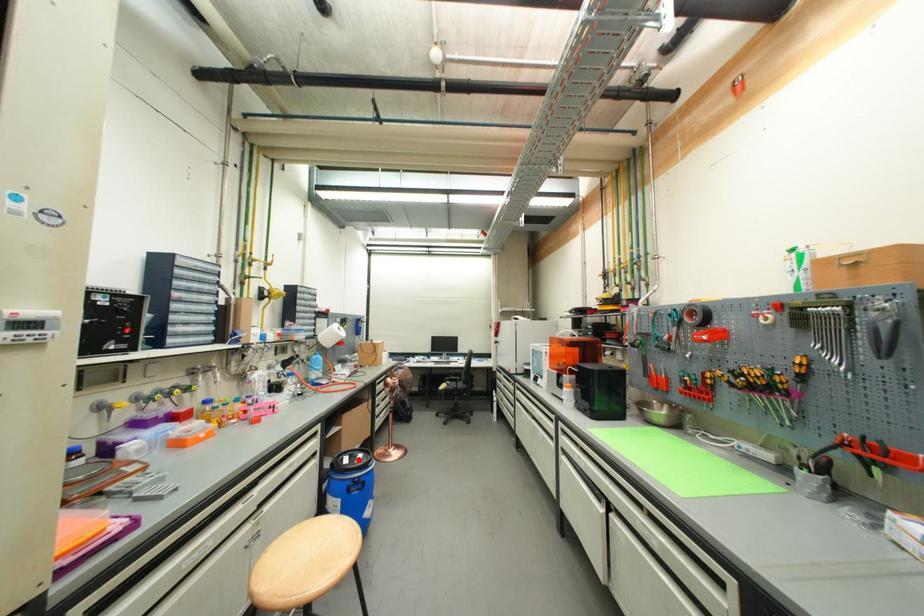
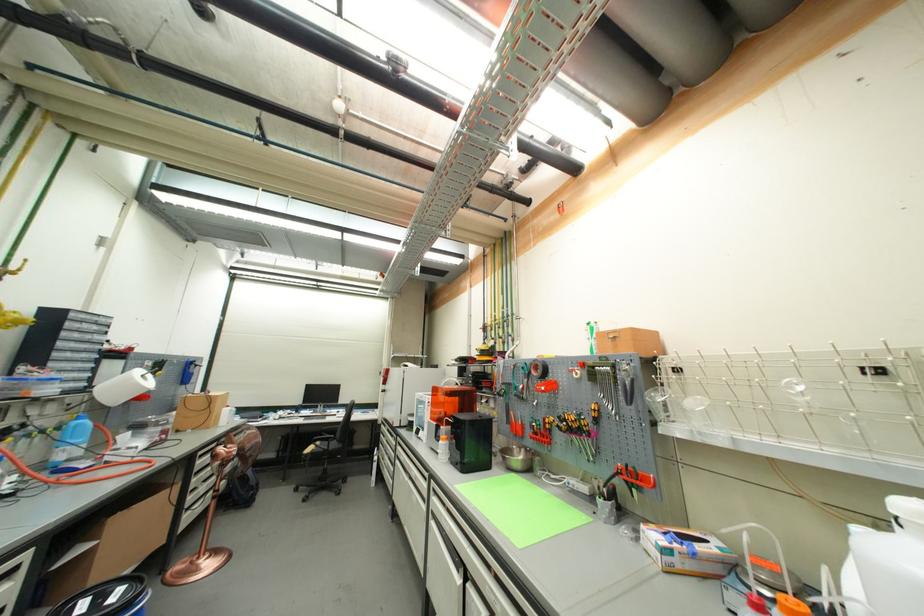
Question: I am providing you with two images of the same scene from different viewpoints. Image1 has a red point marked. In image2, the corresponding 3D location appears at what relative position? Reply with the corresponding letter.

Choices:
 (A) Closer
 (B) Farther

Answer: (B)